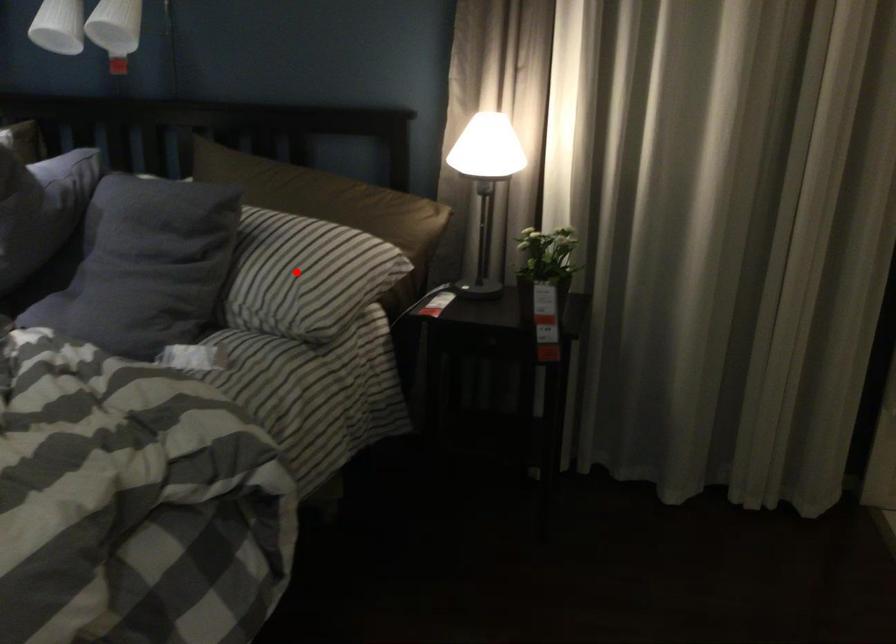
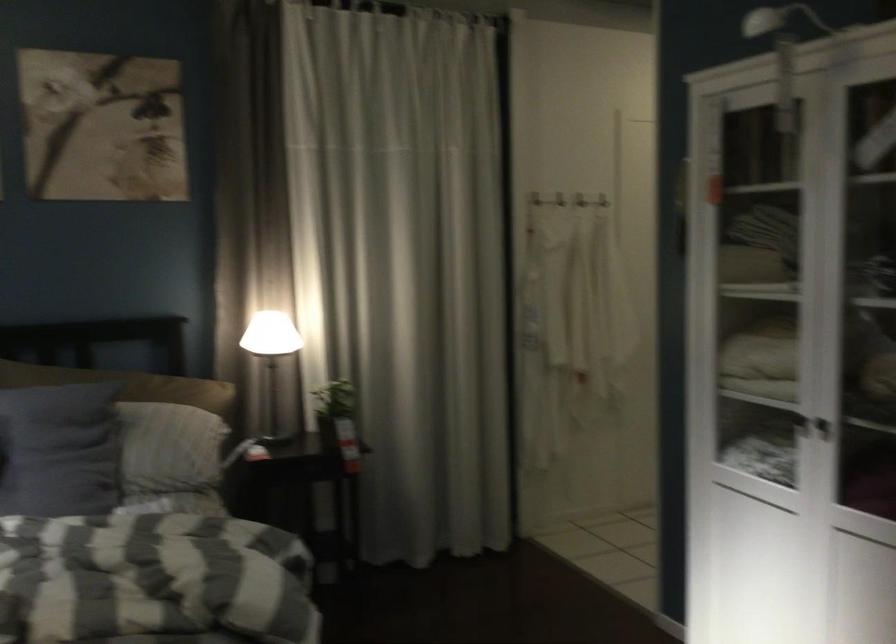
The point at the highlighted location is marked in the first image. Where is the corresponding point in the second image?

(173, 442)